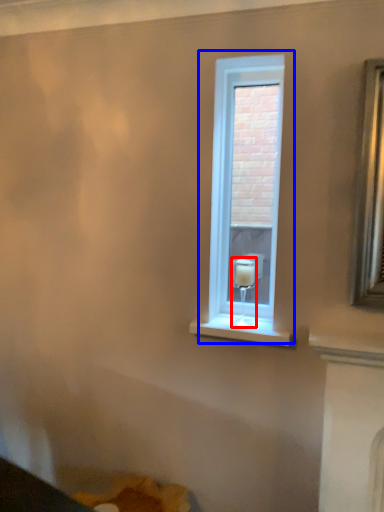
Question: Which object appears closest to the camera in this image, candle holder (highlighted by a red box) or window (highlighted by a blue box)?

Choices:
 (A) candle holder
 (B) window

Answer: (A)